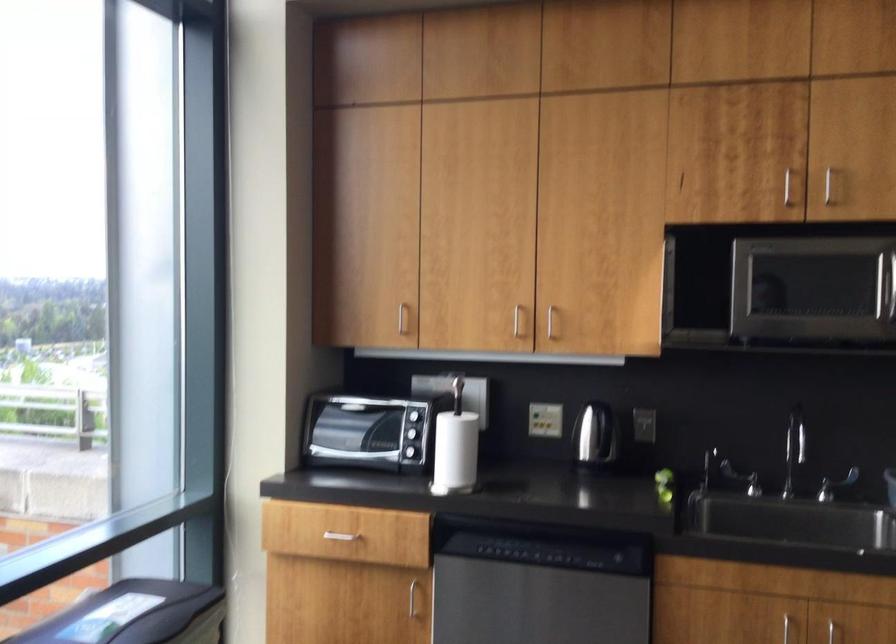
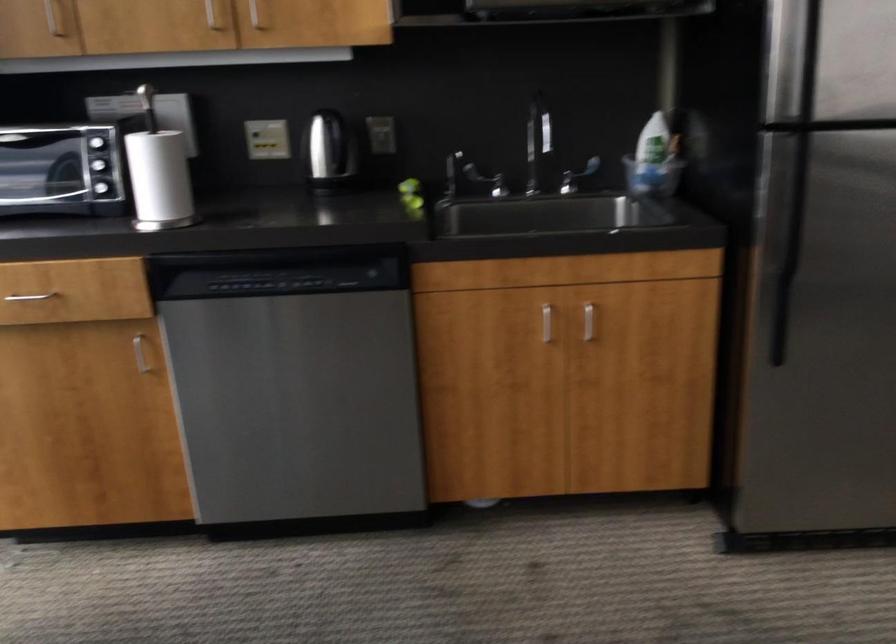
What movement of the cameraman would produce the second image?

The cameraman walked toward left, forward.